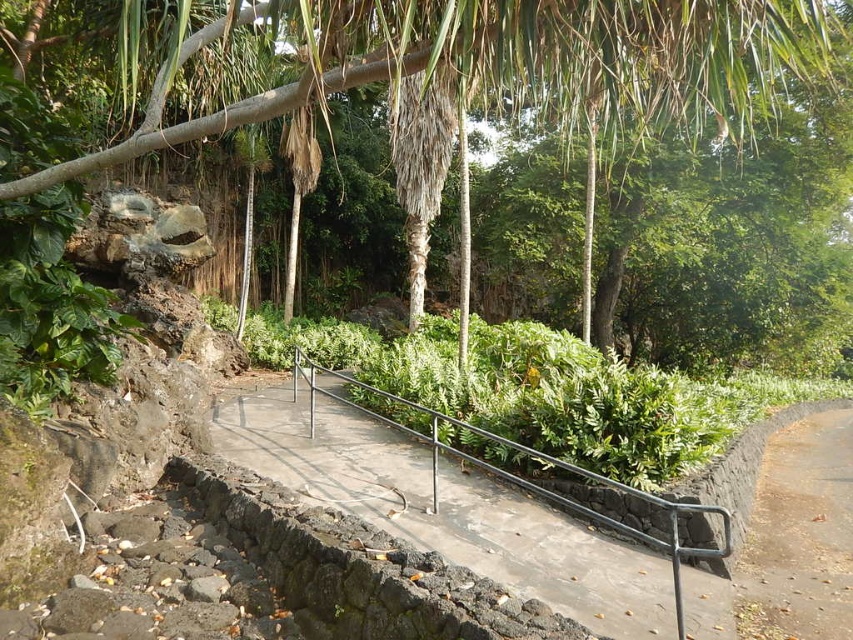
Between point (740, 76) and point (752, 531), which one is positioned in front?

Point (740, 76) is in front.

Who is taller, green leafy tree at center or dirt path at lower right?

green leafy tree at center is taller.

Where is `green leafy tree at center`? green leafy tree at center is located at coordinates (468, 60).

Where is `green leafy tree at center`? This screenshot has height=640, width=853. green leafy tree at center is located at coordinates (468, 60).

Between point (242, 26) and point (585, 608), which one is positioned behind?

The point (242, 26) is behind.

Can you confirm if green leafy tree at center is positioned below concrete at center?

No.

At what (x,y) coordinates should I click in order to perform the action: click on green leafy tree at center. Please return your answer as a coordinate pair (x, y). Looking at the image, I should click on coord(468,60).

Does concrete at center appear on the right side of dirt path at lower right?

Incorrect, concrete at center is not on the right side of dirt path at lower right.

Who is positioned more to the left, concrete at center or dirt path at lower right?

concrete at center

Who is more forward, [454,488] or [807,472]?

Point [454,488] is in front.

The height and width of the screenshot is (640, 853). I want to click on concrete at center, so click(445, 508).